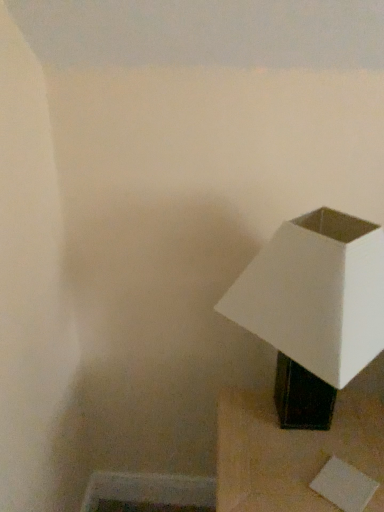
Where is `vacant space in white matte lampshade at right (from a real-world perspective)`? This screenshot has width=384, height=512. vacant space in white matte lampshade at right (from a real-world perspective) is located at coordinates (304, 437).